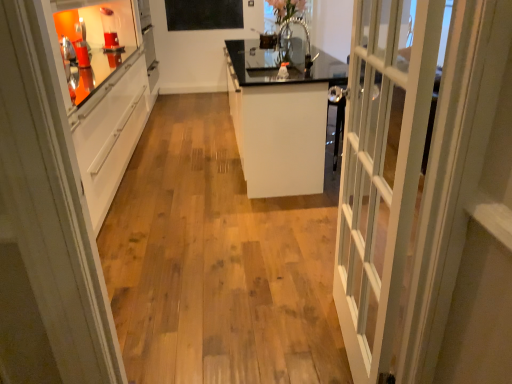
Question: From the image's perspective, is clear glass vase at upper center on top of white glossy cabinet at center?

Choices:
 (A) no
 (B) yes

Answer: (B)

Question: Is clear glass vase at upper center positioned before white glossy cabinet at center?

Choices:
 (A) yes
 (B) no

Answer: (B)

Question: Is clear glass vase at upper center to the left of white glossy cabinet at center from the viewer's perspective?

Choices:
 (A) yes
 (B) no

Answer: (B)

Question: Considering the relative positions of clear glass vase at upper center and white glossy cabinet at center in the image provided, is clear glass vase at upper center behind white glossy cabinet at center?

Choices:
 (A) no
 (B) yes

Answer: (B)

Question: From a real-world perspective, does clear glass vase at upper center sit lower than white glossy cabinet at center?

Choices:
 (A) no
 (B) yes

Answer: (A)

Question: From the image's perspective, is white glossy cabinet at left above or below clear glass vase at upper center?

Choices:
 (A) below
 (B) above

Answer: (A)

Question: Is white glossy cabinet at left bigger or smaller than clear glass vase at upper center?

Choices:
 (A) small
 (B) big

Answer: (B)

Question: Is white glossy cabinet at left taller or shorter than clear glass vase at upper center?

Choices:
 (A) tall
 (B) short

Answer: (A)

Question: Does point (72, 296) appear closer or farther from the camera than point (303, 18)?

Choices:
 (A) farther
 (B) closer

Answer: (B)

Question: Which is correct: clear glass vase at upper center is inside black matte bulletin board at upper center, or outside of it?

Choices:
 (A) outside
 (B) inside

Answer: (A)

Question: Is clear glass vase at upper center to the left or to the right of black matte bulletin board at upper center in the image?

Choices:
 (A) right
 (B) left

Answer: (A)

Question: From the image's perspective, relative to black matte bulletin board at upper center, is clear glass vase at upper center above or below?

Choices:
 (A) above
 (B) below

Answer: (B)

Question: Is clear glass vase at upper center in front of or behind black matte bulletin board at upper center in the image?

Choices:
 (A) front
 (B) behind

Answer: (A)

Question: From the image's perspective, is white glossy cabinet at center located above or below clear glass vase at upper center?

Choices:
 (A) above
 (B) below

Answer: (B)

Question: Is white glossy cabinet at center inside or outside of clear glass vase at upper center?

Choices:
 (A) inside
 (B) outside

Answer: (B)